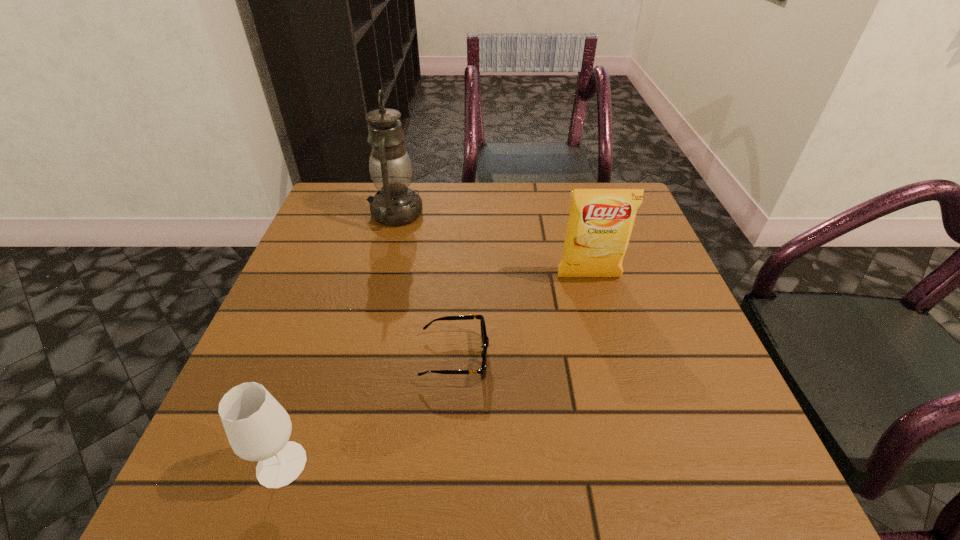
Where is `free area in between the rightmost object and the oil lamp`? free area in between the rightmost object and the oil lamp is located at coordinates (492, 245).

Where is `vacant point located between the second tallest object and the farthest object`? The height and width of the screenshot is (540, 960). vacant point located between the second tallest object and the farthest object is located at coordinates (492, 245).

I want to click on unoccupied area between the glass and the farthest object, so click(339, 339).

The height and width of the screenshot is (540, 960). I want to click on vacant space that is in between the third object from left to right and the oil lamp, so click(425, 285).

At what (x,y) coordinates should I click in order to perform the action: click on object that stands as the third closest to the shortest object. Please return your answer as a coordinate pair (x, y). The image size is (960, 540). Looking at the image, I should click on (390, 167).

Where is `object that is the closest one to the second object from right to left`? object that is the closest one to the second object from right to left is located at coordinates (258, 428).

What are the coordinates of `blank space that satisfies the following two spatial constraints: 1. on the back side of the third tallest object; 2. on the left side of the farthest object` in the screenshot? It's located at (367, 213).

Where is `blank space that satisfies the following two spatial constraints: 1. on the front of the rightmost object with the logo; 2. on the front-facing side of the sunglasses`? blank space that satisfies the following two spatial constraints: 1. on the front of the rightmost object with the logo; 2. on the front-facing side of the sunglasses is located at coordinates (611, 357).

Identify the location of vacant space that satisfies the following two spatial constraints: 1. on the front of the third nearest object with the logo; 2. on the front-facing side of the sunglasses. The width and height of the screenshot is (960, 540). (611, 357).